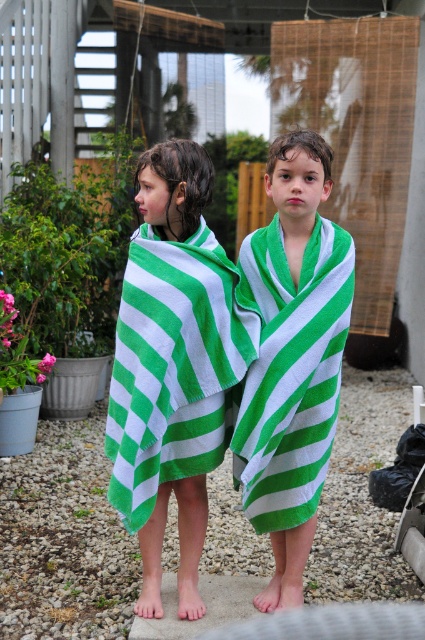
You are a photographer standing at the center of the scene. You want to take a photo that includes both the point at coordinates point (x=133, y=285) and point (x=333, y=310). Which point should be placed closer to the front of the photo to ensure both are visible?

Point (x=133, y=285) is in front of point (x=333, y=310), so placing point (x=133, y=285) closer to the front of the photo will ensure both are visible.

You are a photographer setting up a shot of the two children wearing the green striped towel at left and the green striped towel at center. Which child should you position closer to the camera to make their towels appear the same size in the photo?

Position the child wearing the green striped towel at center closer to the camera because the green striped towel at left is wider than the green striped towel at center. By moving the smaller towel closer, they will appear similar in size in the photo.

You are a photographer setting up a shot of the two children wearing the green striped towel at left and the green striped towel at center. You want to ensure both towels are visible in the frame. Based on their positions, which towel should you focus on first to capture both in the shot?

The green striped towel at left is below the green striped towel at center. To capture both in the frame, focus on the green striped towel at center first as it is higher up, ensuring the lower one is still within the shot.